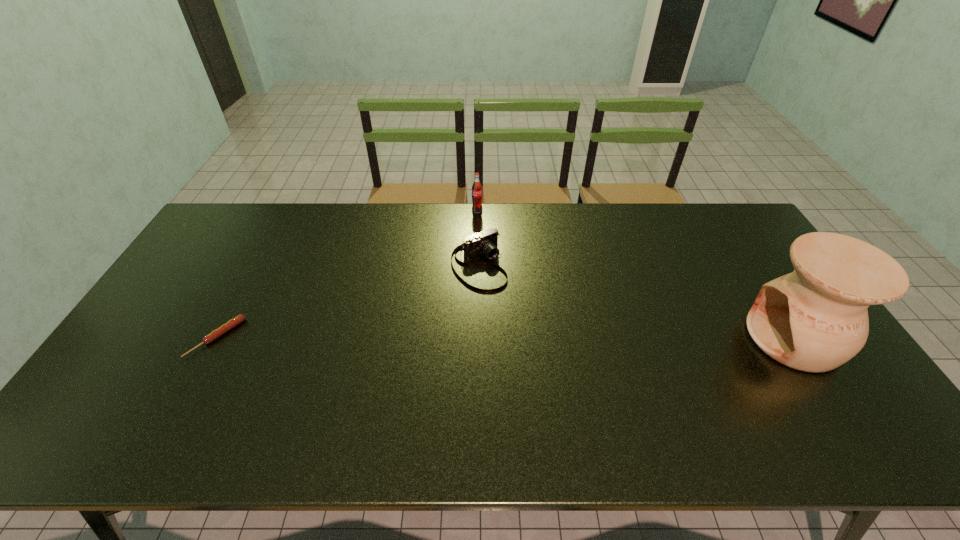
This screenshot has height=540, width=960. Identify the location of empty space between the third tallest object and the tallest object. (636, 301).

Where is `vacant space in between the shortest object and the tallest object`? vacant space in between the shortest object and the tallest object is located at coordinates (505, 338).

At what (x,y) coordinates should I click in order to perform the action: click on vacant space that is in between the second shortest object and the shortest object. Please return your answer as a coordinate pair (x, y). This screenshot has height=540, width=960. Looking at the image, I should click on (348, 301).

Identify the location of blank region between the farthest object and the pottery. (636, 274).

Identify the location of vacant area that lies between the tallest object and the leftmost object. The height and width of the screenshot is (540, 960). (505, 338).

Identify the location of free space that is in between the camera and the leftmost object. The height and width of the screenshot is (540, 960). (348, 301).

Select which object is the closest to the farthest object. Please provide its 2D coordinates. Your answer should be formatted as a tuple, i.e. [(x, y)], where the tuple contains the x and y coordinates of a point satisfying the conditions above.

[(486, 242)]

Point out which object is positioned as the nearest to the second tallest object. Please provide its 2D coordinates. Your answer should be formatted as a tuple, i.e. [(x, y)], where the tuple contains the x and y coordinates of a point satisfying the conditions above.

[(486, 242)]

At what (x,y) coordinates should I click in order to perform the action: click on vacant space that satisfies the following two spatial constraints: 1. on the front side of the tallest object; 2. at the open side of the soda bottle. Please return your answer as a coordinate pair (x, y). This screenshot has width=960, height=540. Looking at the image, I should click on (476, 338).

Where is `free space in the image that satisfies the following two spatial constraints: 1. on the back side of the second shortest object; 2. on the right side of the sausage`? free space in the image that satisfies the following two spatial constraints: 1. on the back side of the second shortest object; 2. on the right side of the sausage is located at coordinates (256, 264).